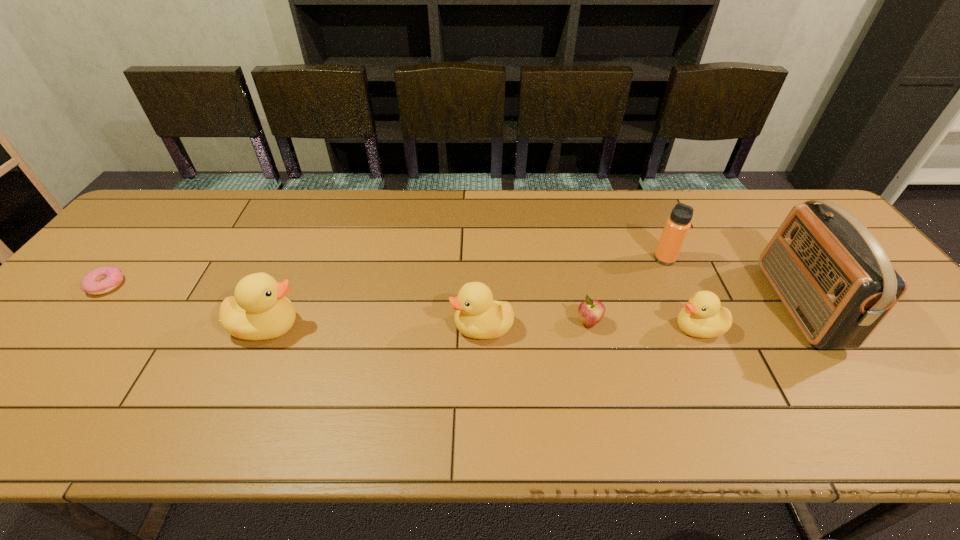
At what (x,y) coordinates should I click in order to perform the action: click on free space between the shortest object and the second shortest object. Please return your answer as a coordinate pair (x, y). Looking at the image, I should click on (348, 304).

Image resolution: width=960 pixels, height=540 pixels. Find the location of `empty location between the doughnut and the sixth object from right to left`. empty location between the doughnut and the sixth object from right to left is located at coordinates click(x=187, y=306).

At what (x,y) coordinates should I click in order to perform the action: click on vacant space that's between the rightmost duckling and the thermos bottle. Please return your answer as a coordinate pair (x, y). This screenshot has width=960, height=540. Looking at the image, I should click on (682, 293).

Find the location of a particular element. unoccupied area between the apple and the rightmost duckling is located at coordinates (643, 326).

Identify the location of unoccupied area between the fifth tallest object and the radio receiver. (748, 316).

I want to click on free spot between the doughnut and the apple, so click(x=348, y=304).

This screenshot has width=960, height=540. In order to click on unoccupied area between the tallest object and the thermos bottle in this screenshot , I will do `click(732, 282)`.

Where is `vacant area that lies between the thermos bottle and the tallest object`? This screenshot has height=540, width=960. vacant area that lies between the thermos bottle and the tallest object is located at coordinates (732, 282).

What are the coordinates of `free space that is in between the sixth tallest object and the second shortest duckling` in the screenshot? It's located at (536, 325).

Find the location of `object that is the third closest one to the tallest object`. object that is the third closest one to the tallest object is located at coordinates (590, 311).